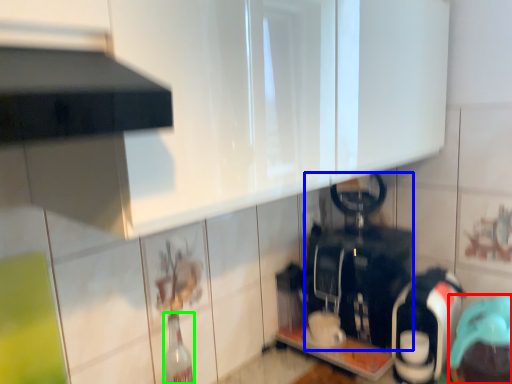
Question: Which object is positioned farthest from appliance (highlighted by a red box)? Select from appliance (highlighted by a blue box) and bottle (highlighted by a green box).

Choices:
 (A) appliance
 (B) bottle

Answer: (B)